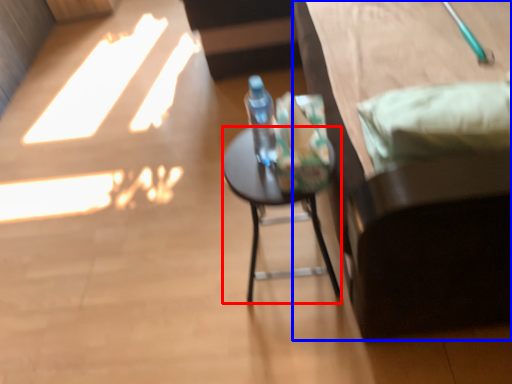
Question: Which object is further to the camera taking this photo, desk (highlighted by a red box) or furniture (highlighted by a blue box)?

Choices:
 (A) desk
 (B) furniture

Answer: (A)